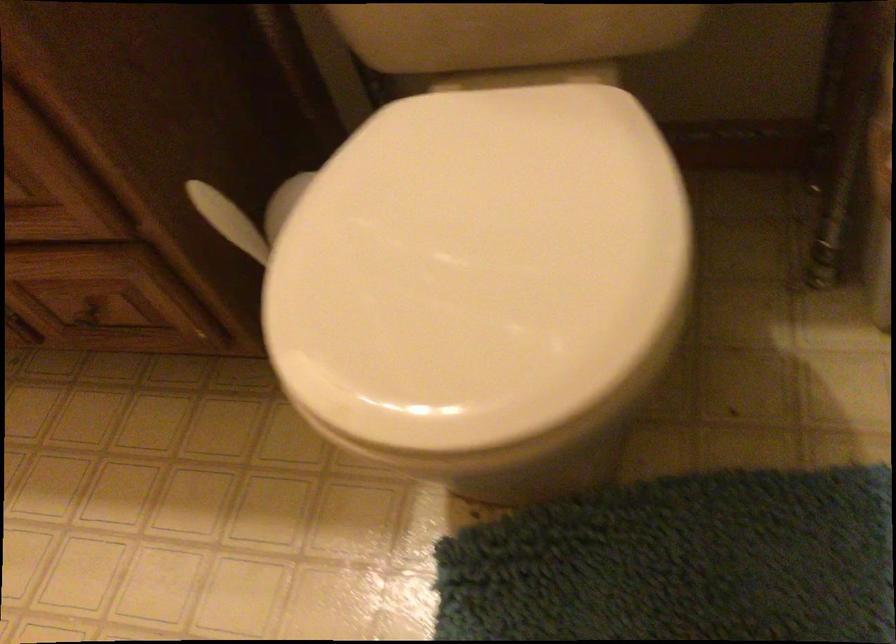
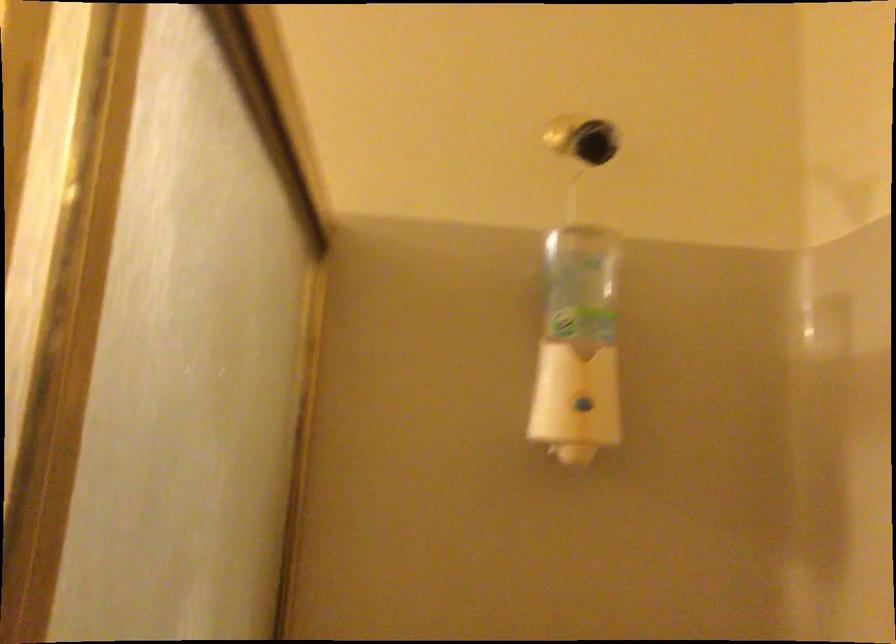
The first image is from the beginning of the video and the second image is from the end. How did the camera likely rotate when shooting the video?

The camera rotated toward right-up.